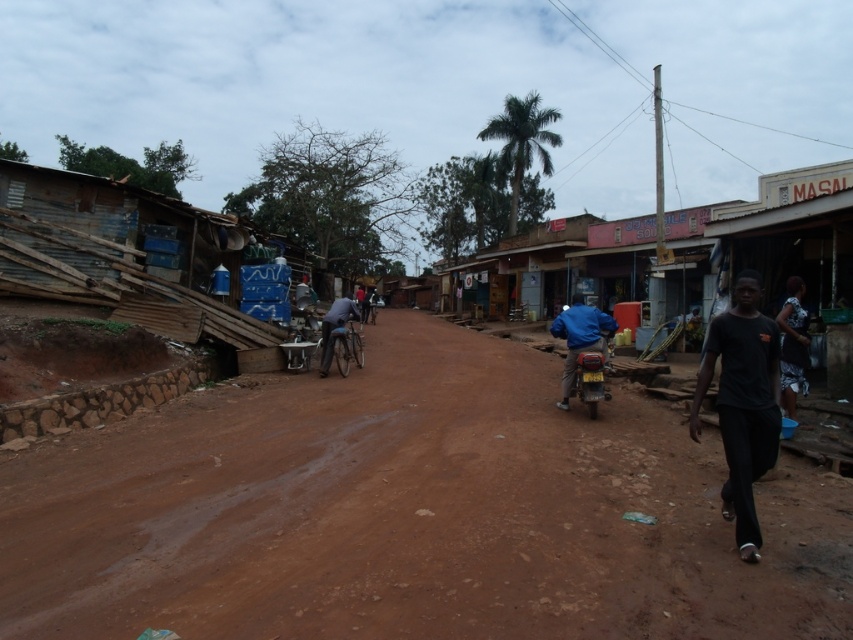
You are standing at the point labeled as point (595, 372) and want to walk towards the point labeled as point (775, 440). Which direction should you move relative to the camera?

You should move towards the camera because point (775, 440) is closer to the camera than point (595, 372).

You are standing at the center of the road in the village scene. You see a dark gray fabric dress at lower right. Is the dark gray fabric dress at lower right located to the left or right of the point at coordinates (793, 346)?

The dark gray fabric dress at lower right is located at the point with coordinates (793, 346).

You are standing at the point marked as point (741, 403) in the image. What object or clothing item is directly beneath your feet?

The point (741, 403) is on black matte shirt at right, so the black matte shirt at right is directly beneath your feet.